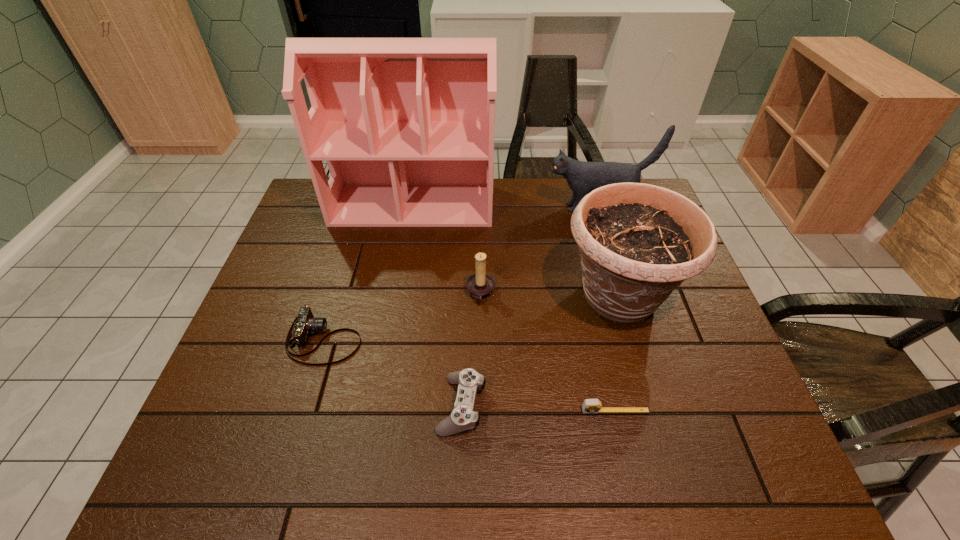
The height and width of the screenshot is (540, 960). In order to click on free area in between the control and the camera in this screenshot , I will do `click(393, 373)`.

Image resolution: width=960 pixels, height=540 pixels. I want to click on the third closest object to the fourth shortest object, so click(x=406, y=125).

Locate an element on the screen. object identified as the second closest to the camera is located at coordinates (480, 285).

I want to click on vacant position in the image that satisfies the following two spatial constraints: 1. on the front-facing side of the control; 2. on the right side of the dollhouse, so click(x=378, y=405).

Find the location of a particular element. free space that satisfies the following two spatial constraints: 1. on the front-facing side of the dollhouse; 2. on the right side of the control is located at coordinates pyautogui.click(x=378, y=405).

Locate an element on the screen. vacant point that satisfies the following two spatial constraints: 1. on the front-facing side of the dollhouse; 2. on the left side of the flowerpot is located at coordinates coord(396,297).

I want to click on free space that satisfies the following two spatial constraints: 1. on the wick of the fourth tallest object; 2. on the left side of the flowerpot, so click(x=481, y=297).